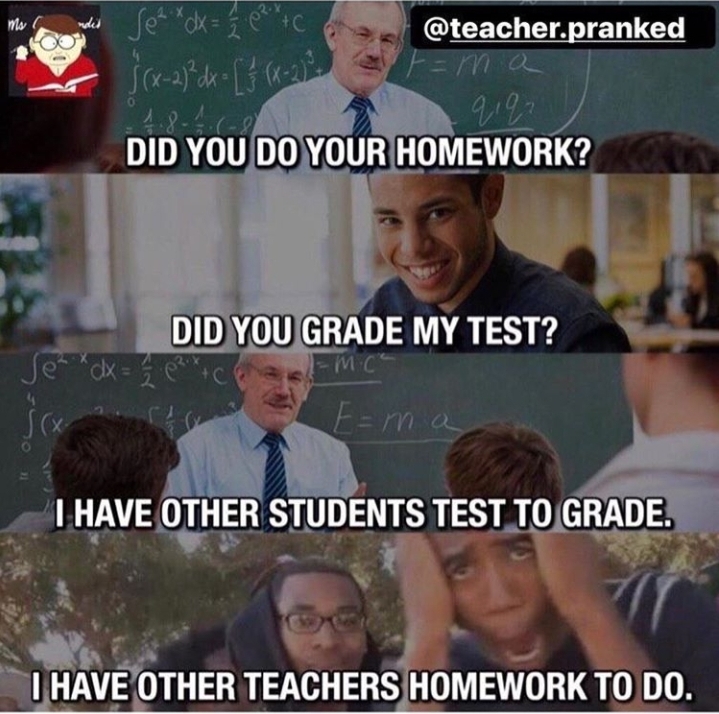
Locate the what you write on with chalk in the image. Your answer should be formatted as a list of tuples, i.e. [(x1, y1), (x2, y2), ...], where each tuple contains the x and y coordinates of a point satisfying the conditions above.

[(512, 398), (567, 86)]